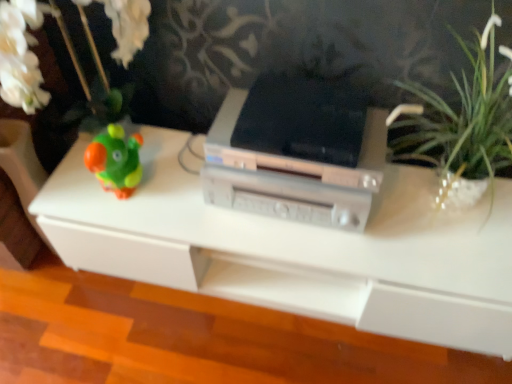
Question: Would you say silver metallic printer at center is inside or outside white plastic table at center?

Choices:
 (A) outside
 (B) inside

Answer: (A)

Question: Is silver metallic printer at center to the left or to the right of white plastic table at center in the image?

Choices:
 (A) left
 (B) right

Answer: (A)

Question: Is silver metallic printer at center taller or shorter than white plastic table at center?

Choices:
 (A) tall
 (B) short

Answer: (B)

Question: Would you say white plastic table at center is to the left or to the right of silver metallic printer at center in the picture?

Choices:
 (A) right
 (B) left

Answer: (A)

Question: Considering the positions of white plastic table at center and silver metallic printer at center in the image, is white plastic table at center taller or shorter than silver metallic printer at center?

Choices:
 (A) tall
 (B) short

Answer: (A)

Question: From the image's perspective, is white plastic table at center above or below silver metallic printer at center?

Choices:
 (A) above
 (B) below

Answer: (B)

Question: In terms of size, does white plastic table at center appear bigger or smaller than silver metallic printer at center?

Choices:
 (A) small
 (B) big

Answer: (B)